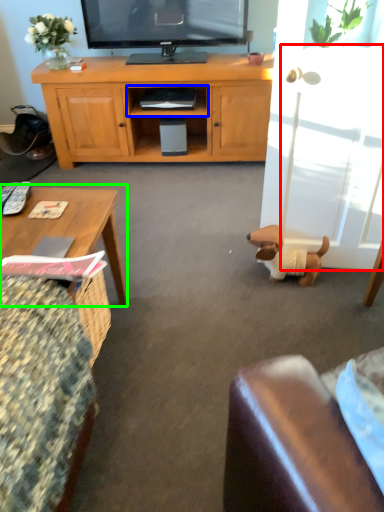
Question: Considering the real-world distances, which object is closest to glass door (highlighted by a red box)? shelf (highlighted by a blue box) or coffee table (highlighted by a green box).

Choices:
 (A) shelf
 (B) coffee table

Answer: (B)